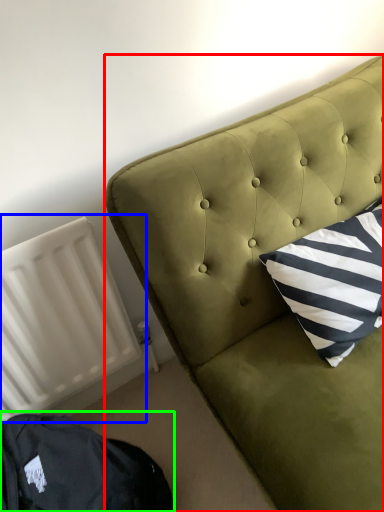
Question: Based on their relative distances, which object is farther from furniture (highlighted by a red box)? Choose from radiator (highlighted by a blue box) and bean bag chair (highlighted by a green box).

Choices:
 (A) radiator
 (B) bean bag chair

Answer: (B)